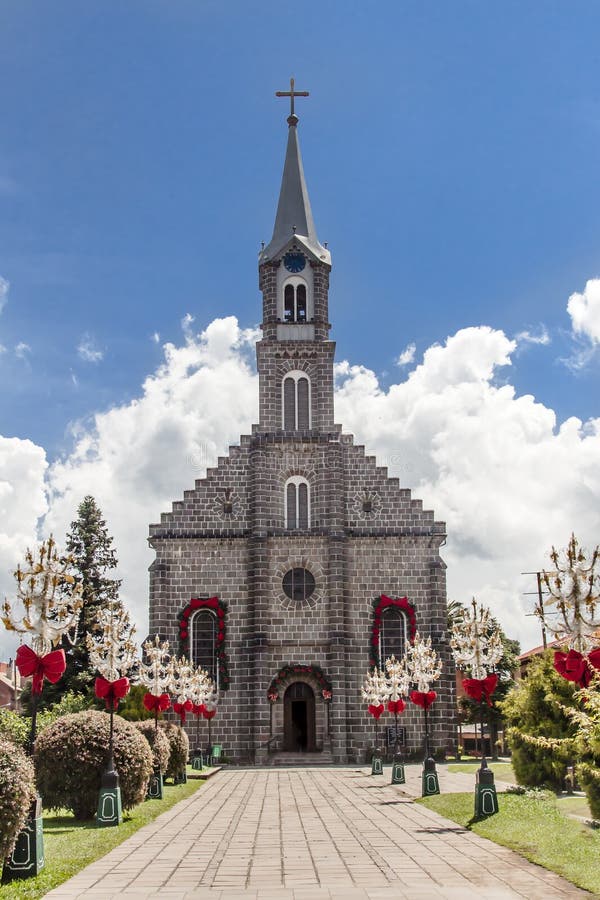
Locate an element on the screen. The height and width of the screenshot is (900, 600). red bows is located at coordinates (40, 671).